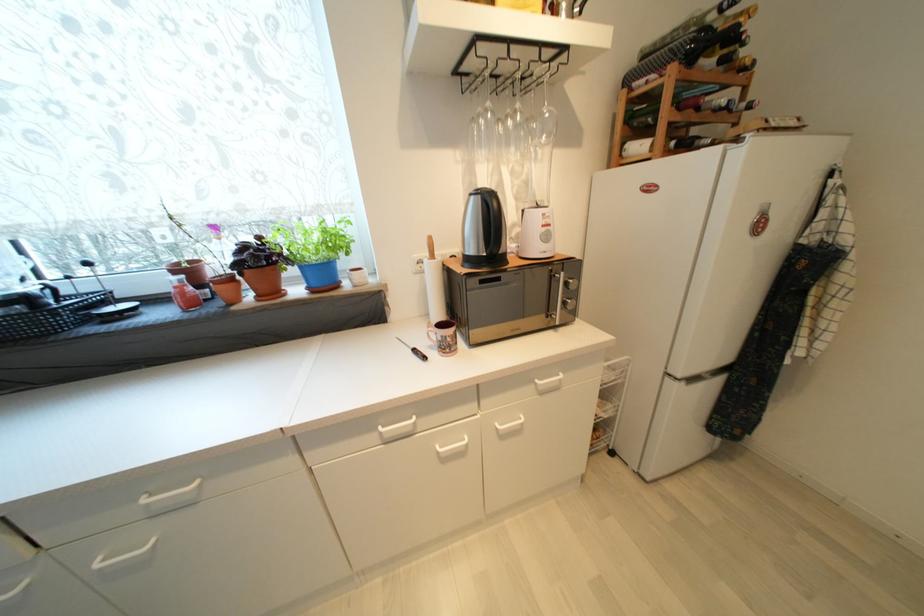
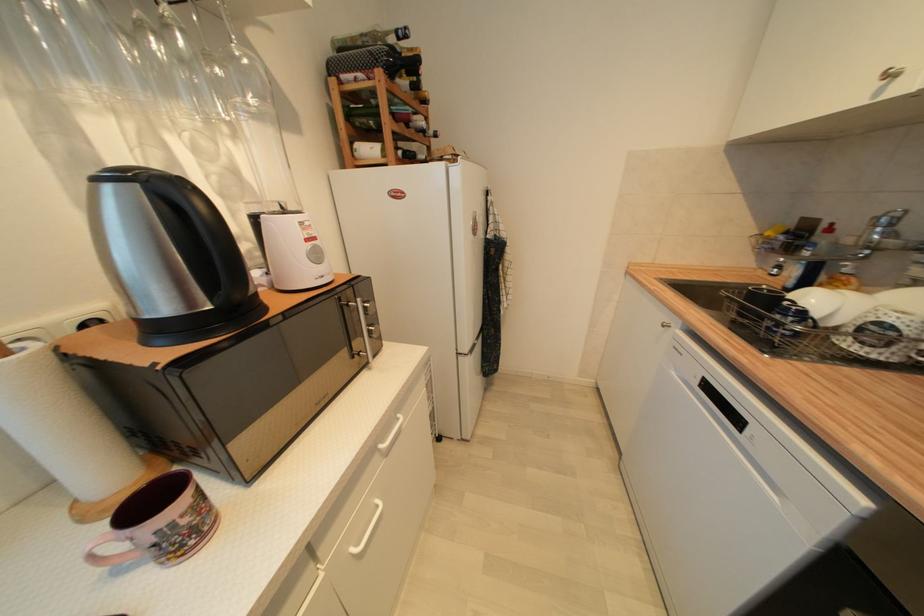
Question: The camera is either moving clockwise (left) or counter-clockwise (right) around the object. The first image is from the beginning of the video and the second image is from the end. Is the camera moving left or right when shooting the video?

Choices:
 (A) Left
 (B) Right

Answer: (A)